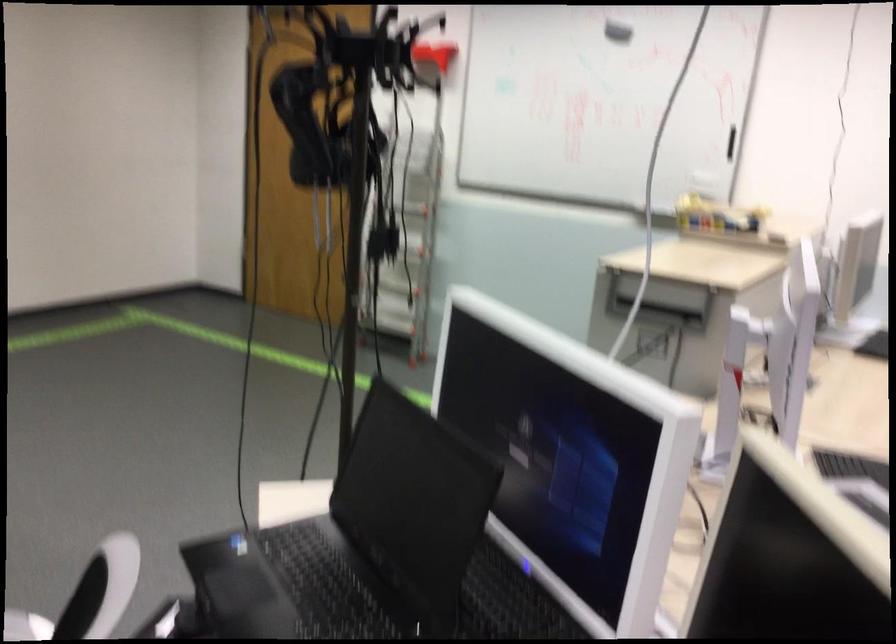
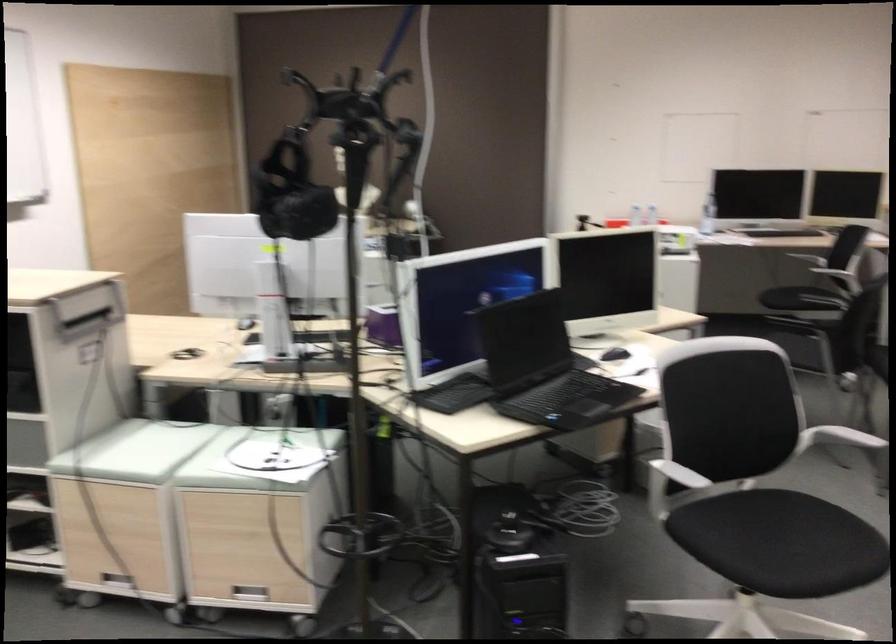
Find the pixel in the second image that matches (309,136) in the first image.

(291, 192)